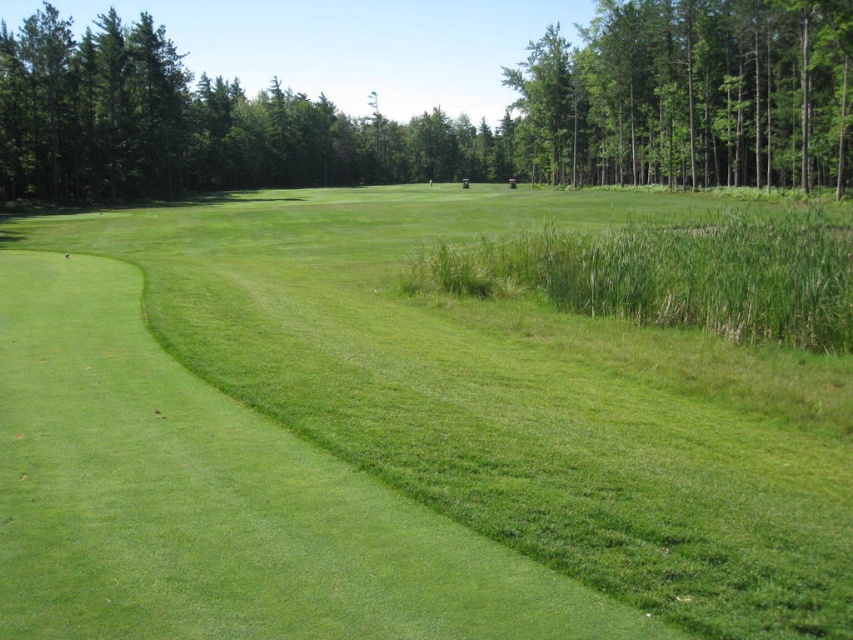
Question: Does green grassy field at center appear over green leafy trees at upper right?

Choices:
 (A) no
 (B) yes

Answer: (A)

Question: Which object is farther from the camera taking this photo?

Choices:
 (A) green grassy field at center
 (B) green leafy trees at upper right
 (C) green leafy tree at upper center

Answer: (C)

Question: Which object is farther from the camera taking this photo?

Choices:
 (A) green grassy field at center
 (B) green leafy trees at upper right

Answer: (B)

Question: Is green grassy field at center smaller than green leafy trees at upper right?

Choices:
 (A) yes
 (B) no

Answer: (A)

Question: Is green leafy tree at upper center behind green leafy trees at upper right?

Choices:
 (A) yes
 (B) no

Answer: (A)

Question: Among these points, which one is nearest to the camera?

Choices:
 (A) (560, 42)
 (B) (599, 77)

Answer: (B)